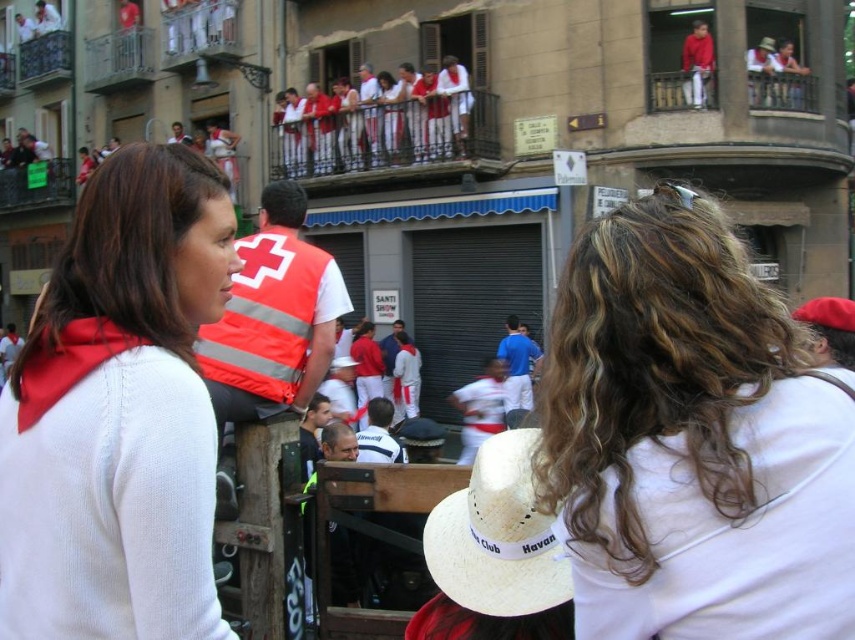
Question: Which of the following is the farthest from the observer?

Choices:
 (A) white straw cowboy hat at upper center
 (B) straw hat at center
 (C) white matte sweater at upper left
 (D) white straw cowboy hat at center

Answer: (A)

Question: Can you confirm if straw hat at center is thinner than white straw cowboy hat at center?

Choices:
 (A) yes
 (B) no

Answer: (A)

Question: Estimate the real-world distances between objects in this image. Which object is closer to the white wavy hair at center?

Choices:
 (A) white straw cowboy hat at center
 (B) white matte sweater at upper left

Answer: (B)

Question: Is white wavy hair at center wider than white matte sweater at upper left?

Choices:
 (A) no
 (B) yes

Answer: (A)

Question: Which of the following is the closest to the observer?

Choices:
 (A) (447, 516)
 (B) (774, 541)
 (C) (765, 44)

Answer: (B)

Question: Does white straw cowboy hat at center lie in front of white straw cowboy hat at upper center?

Choices:
 (A) no
 (B) yes

Answer: (B)